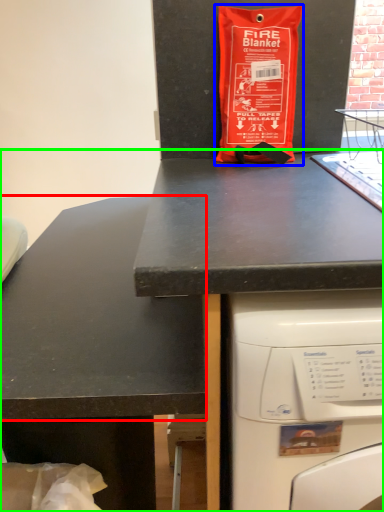
Question: Which is farther away from counter top (highlighted by a red box)? bag (highlighted by a blue box) or desk (highlighted by a green box)?

Choices:
 (A) bag
 (B) desk

Answer: (A)